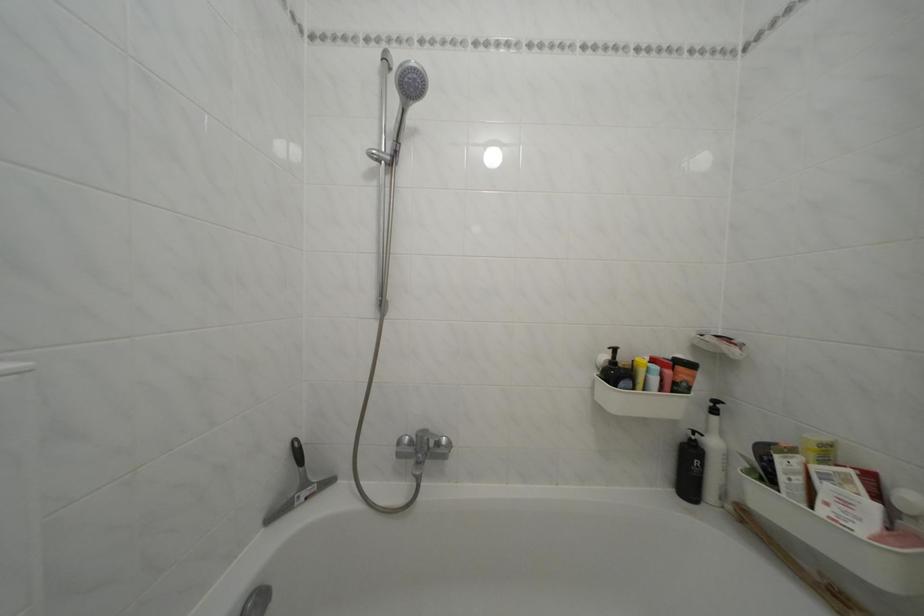
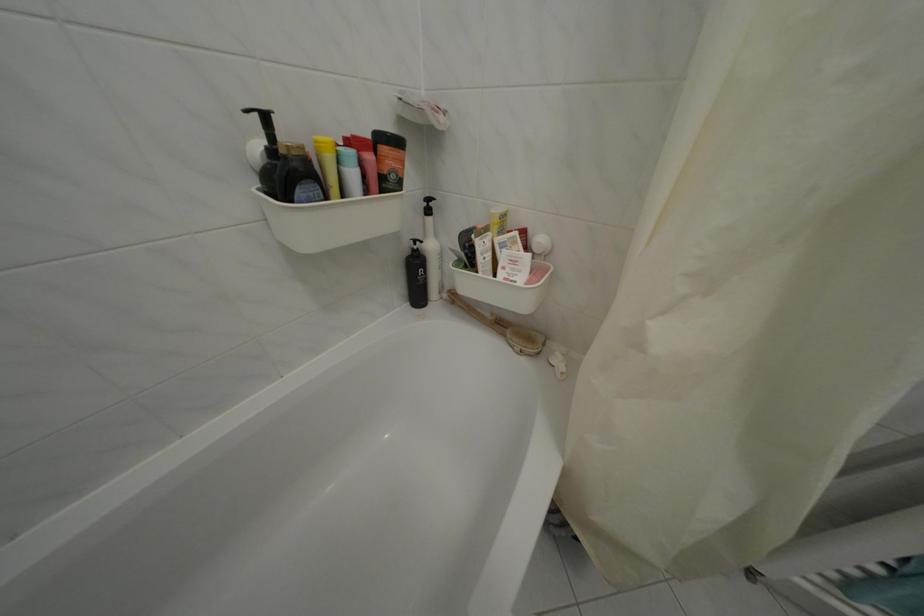
Where in the second image is the point corresponding to (x=671, y=387) from the first image?

(372, 182)